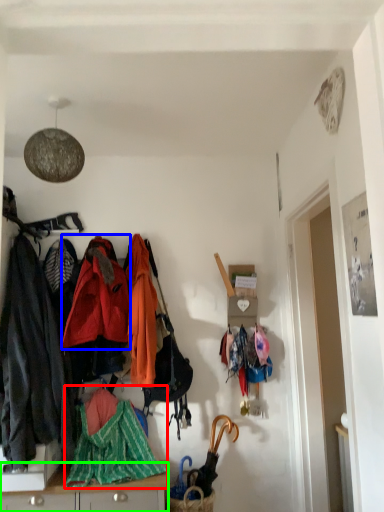
Question: Which object is positioned farthest from blanket (highlighted by a red box)? Select from jacket (highlighted by a blue box) and cabinetry (highlighted by a green box).

Choices:
 (A) jacket
 (B) cabinetry

Answer: (A)